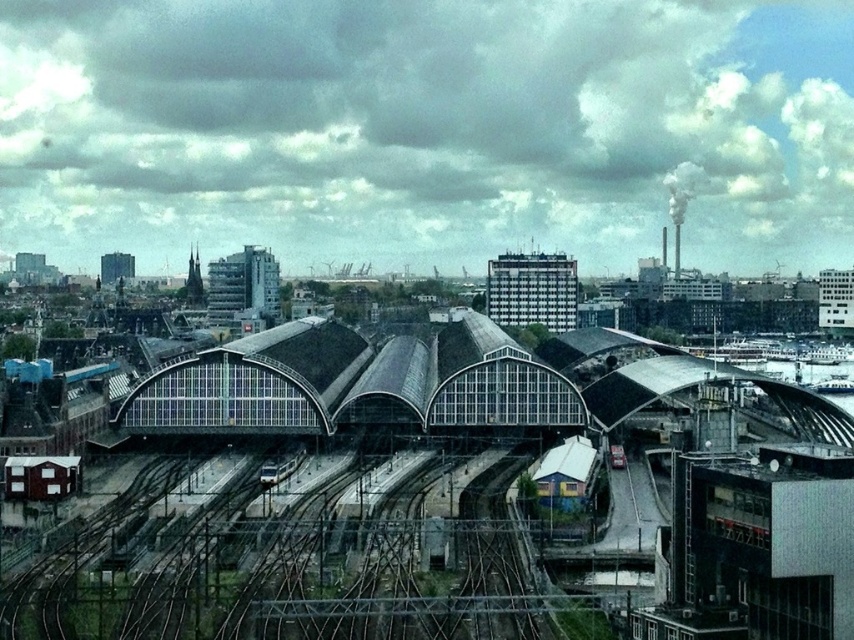
Looking at this image, is metallic gray train tracks at center wider than silver metallic train at center?

Indeed, metallic gray train tracks at center has a greater width compared to silver metallic train at center.

Based on the photo, which is more to the left, metallic gray train tracks at center or silver metallic train at center?

From the viewer's perspective, silver metallic train at center appears more on the left side.

This screenshot has height=640, width=854. Find the location of `metallic gray train tracks at center`. metallic gray train tracks at center is located at coordinates (291, 563).